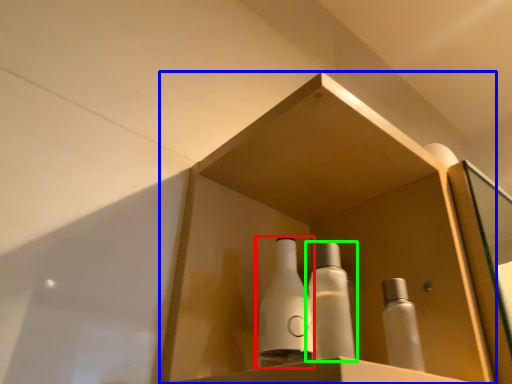
Question: Estimate the real-world distances between objects in this image. Which object is closer to bottle (highlighted by a red box), shelf (highlighted by a blue box) or bottle (highlighted by a green box)?

Choices:
 (A) shelf
 (B) bottle

Answer: (B)